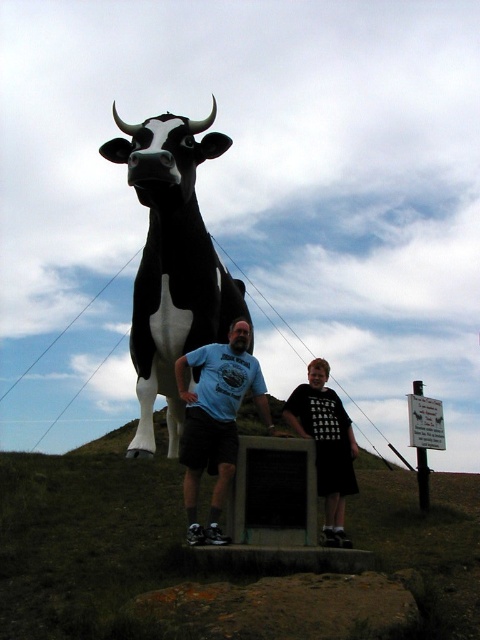
How distant is matte blue t-shirt at center from black matte shirt at center?

matte blue t-shirt at center is 1.18 meters away from black matte shirt at center.

Between matte blue t-shirt at center and black matte shirt at center, which one has more height?

Standing taller between the two is matte blue t-shirt at center.

Locate an element on the screen. The height and width of the screenshot is (640, 480). matte blue t-shirt at center is located at coordinates (216, 420).

Image resolution: width=480 pixels, height=640 pixels. I want to click on matte blue t-shirt at center, so click(216, 420).

Image resolution: width=480 pixels, height=640 pixels. What do you see at coordinates (171, 262) in the screenshot?
I see `black matte cow at center` at bounding box center [171, 262].

What do you see at coordinates (171, 262) in the screenshot?
I see `black matte cow at center` at bounding box center [171, 262].

Where is `black matte cow at center`? This screenshot has width=480, height=640. black matte cow at center is located at coordinates (171, 262).

Describe the element at coordinates (171, 262) in the screenshot. Image resolution: width=480 pixels, height=640 pixels. I see `black matte cow at center` at that location.

Who is more distant from viewer, (146, 442) or (323, 458)?

Positioned behind is point (146, 442).

Image resolution: width=480 pixels, height=640 pixels. Describe the element at coordinates (171, 262) in the screenshot. I see `black matte cow at center` at that location.

Image resolution: width=480 pixels, height=640 pixels. Identify the location of black matte cow at center. (171, 262).